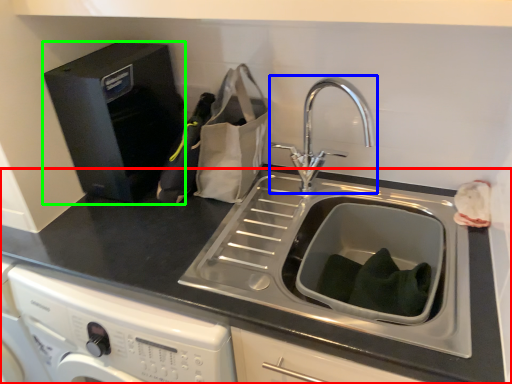
Question: Which object is positioned farthest from countertop (highlighted by a red box)? Select from tap (highlighted by a blue box) and appliance (highlighted by a green box).

Choices:
 (A) tap
 (B) appliance

Answer: (A)